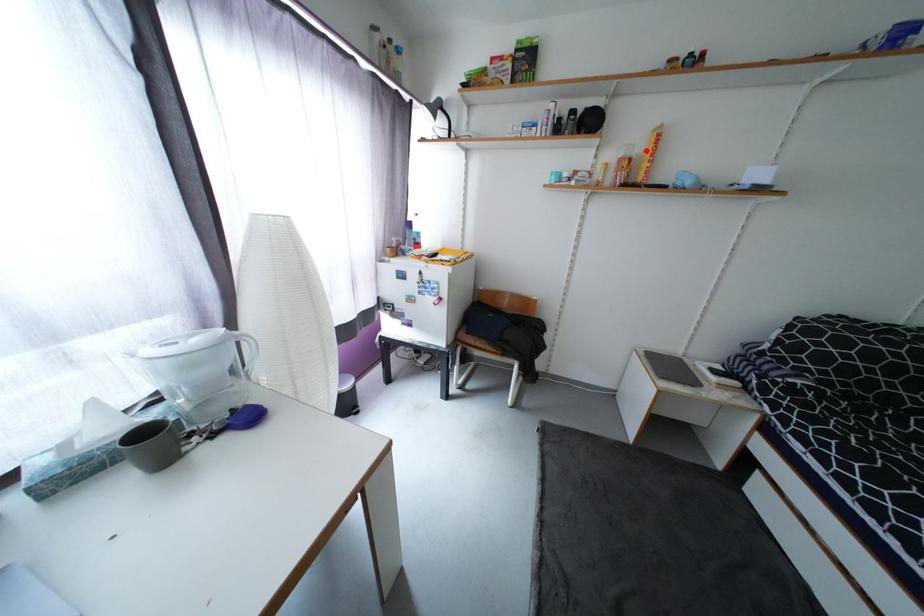
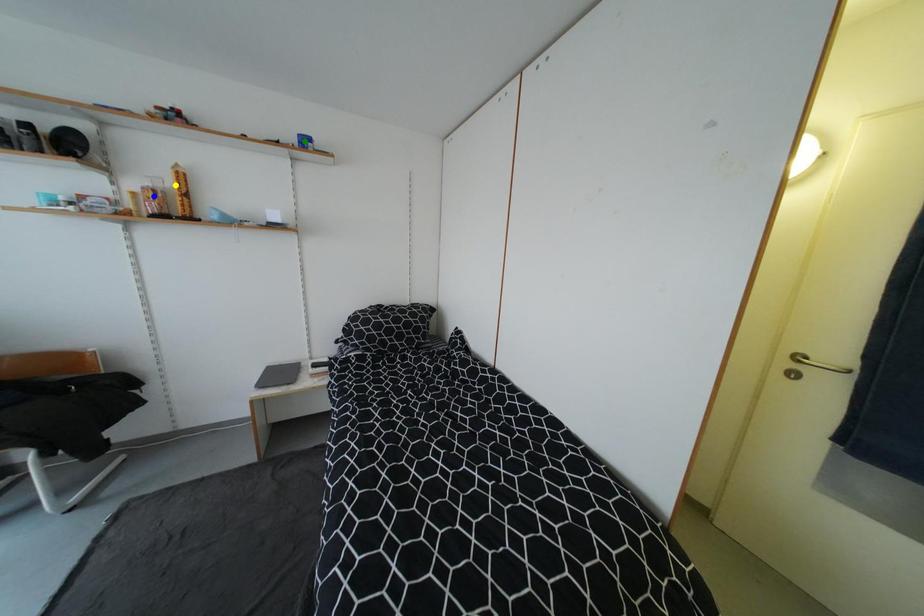
Question: I am providing you with two images of the same scene from different viewpoints. A red point is marked on the first image. You are given multiple points on the second image. In image 2, which mark is for the same physical point as the one in image 1?

Choices:
 (A) green point
 (B) yellow point
 (C) blue point

Answer: (B)